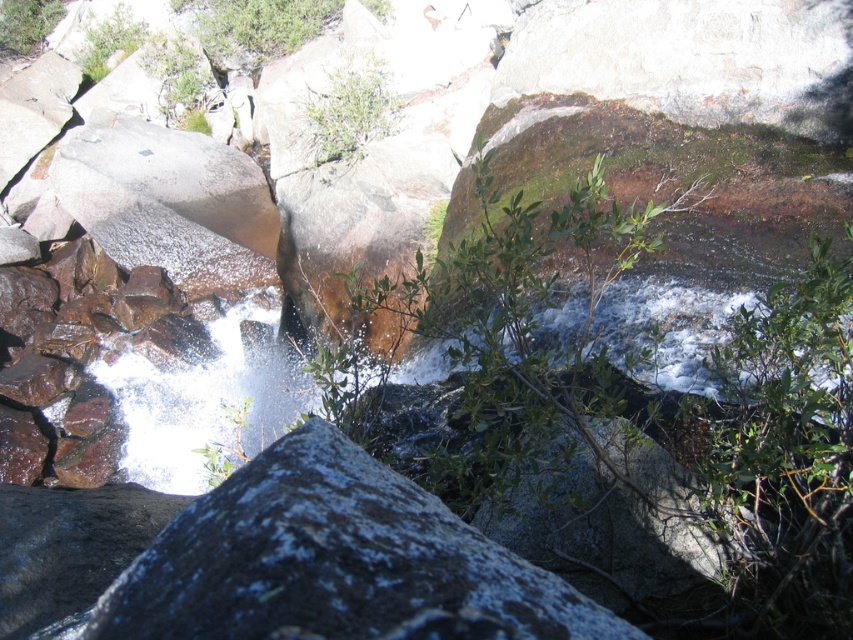
You are a hiker who wants to take a photo of the waterfall. You notice two green leafy bushes in the scene. Which one is closer to you, the green leafy bush at center or the green leafy bush at upper left?

The green leafy bush at center is closer to you because it is in front of the green leafy bush at upper left.